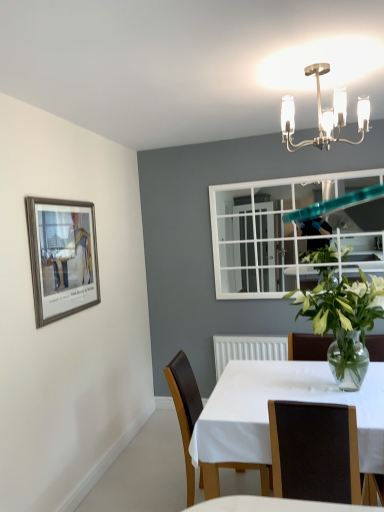
Question: Is polished brass chandelier at upper center further to the viewer compared to white glossy table at center?

Choices:
 (A) yes
 (B) no

Answer: (A)

Question: Is polished brass chandelier at upper center bigger than white glossy table at center?

Choices:
 (A) no
 (B) yes

Answer: (A)

Question: Is polished brass chandelier at upper center surrounding white glossy table at center?

Choices:
 (A) yes
 (B) no

Answer: (B)

Question: Considering the relative positions of polished brass chandelier at upper center and white glossy table at center in the image provided, is polished brass chandelier at upper center to the right of white glossy table at center from the viewer's perspective?

Choices:
 (A) no
 (B) yes

Answer: (B)

Question: Is polished brass chandelier at upper center turned away from white glossy table at center?

Choices:
 (A) no
 (B) yes

Answer: (A)

Question: In terms of width, does brown leather chair at center, placed as the first chair when sorted from back to front, look wider or thinner when compared to white glossy table at center?

Choices:
 (A) thin
 (B) wide

Answer: (A)

Question: From the image's perspective, is brown leather chair at center, placed as the first chair when sorted from back to front, positioned above or below white glossy table at center?

Choices:
 (A) below
 (B) above

Answer: (B)

Question: Considering the positions of point (243, 462) and point (276, 390), is point (243, 462) closer or farther from the camera than point (276, 390)?

Choices:
 (A) farther
 (B) closer

Answer: (B)

Question: Is brown leather chair at center, positioned as the 2th chair in front-to-back order, bigger or smaller than white glossy table at center?

Choices:
 (A) big
 (B) small

Answer: (B)

Question: From the image's perspective, relative to brown leather chair at center, placed as the first chair when sorted from back to front, is polished brass chandelier at upper center above or below?

Choices:
 (A) above
 (B) below

Answer: (A)

Question: Is polished brass chandelier at upper center taller or shorter than brown leather chair at center, positioned as the 2th chair in front-to-back order?

Choices:
 (A) short
 (B) tall

Answer: (A)

Question: Based on their positions, is polished brass chandelier at upper center located to the left or right of brown leather chair at center, placed as the first chair when sorted from back to front?

Choices:
 (A) left
 (B) right

Answer: (B)

Question: Is polished brass chandelier at upper center spatially inside brown leather chair at center, placed as the first chair when sorted from back to front, or outside of it?

Choices:
 (A) outside
 (B) inside

Answer: (A)

Question: In the image, is polished brass chandelier at upper center positioned in front of or behind white glossy table at center?

Choices:
 (A) front
 (B) behind

Answer: (B)

Question: Visually, is polished brass chandelier at upper center positioned to the left or to the right of white glossy table at center?

Choices:
 (A) right
 (B) left

Answer: (A)